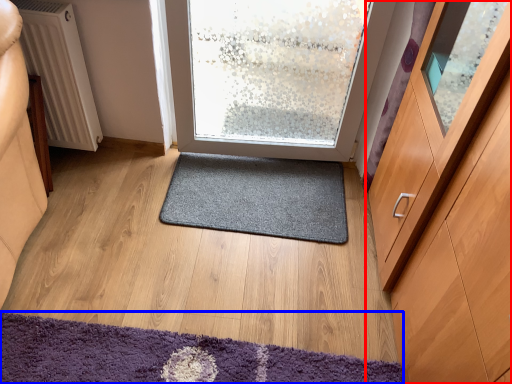
Question: Which point is closer to the camera, cabinetry (highlighted by a red box) or mat (highlighted by a blue box)?

Choices:
 (A) cabinetry
 (B) mat

Answer: (A)